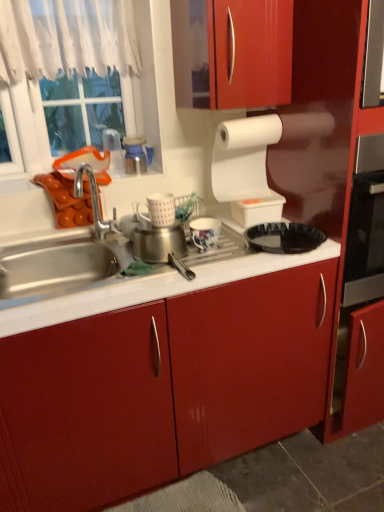
Question: In which direction should I rotate to look at porcelain floral mug at center, the 2th appliance when ordered from right to left?

Choices:
 (A) right
 (B) left

Answer: (A)

Question: Is white sheer curtain at upper left to the right of white matte paper towel at upper right from the viewer's perspective?

Choices:
 (A) yes
 (B) no

Answer: (B)

Question: Is white sheer curtain at upper left to the left of white matte paper towel at upper right from the viewer's perspective?

Choices:
 (A) yes
 (B) no

Answer: (A)

Question: Could you tell me if white sheer curtain at upper left is turned towards white matte paper towel at upper right?

Choices:
 (A) yes
 (B) no

Answer: (B)

Question: Is white sheer curtain at upper left positioned far away from white matte paper towel at upper right?

Choices:
 (A) no
 (B) yes

Answer: (A)

Question: Can you confirm if white sheer curtain at upper left is taller than white matte paper towel at upper right?

Choices:
 (A) yes
 (B) no

Answer: (B)

Question: Does white sheer curtain at upper left have a lesser height compared to white matte paper towel at upper right?

Choices:
 (A) no
 (B) yes

Answer: (B)

Question: Is white sheer curtain at upper left not close to white glossy mug at center, arranged as the second appliance when viewed from the left?

Choices:
 (A) yes
 (B) no

Answer: (B)

Question: Considering the relative positions of white sheer curtain at upper left and white glossy mug at center, arranged as the 3th appliance when viewed from the right, in the image provided, is white sheer curtain at upper left to the right of white glossy mug at center, arranged as the 3th appliance when viewed from the right, from the viewer's perspective?

Choices:
 (A) yes
 (B) no

Answer: (B)

Question: Is white sheer curtain at upper left facing towards white glossy mug at center, arranged as the second appliance when viewed from the left?

Choices:
 (A) no
 (B) yes

Answer: (A)

Question: From a real-world perspective, is white sheer curtain at upper left under white glossy mug at center, arranged as the 3th appliance when viewed from the right?

Choices:
 (A) no
 (B) yes

Answer: (A)

Question: Does white sheer curtain at upper left have a smaller size compared to white glossy mug at center, arranged as the second appliance when viewed from the left?

Choices:
 (A) yes
 (B) no

Answer: (B)

Question: Does white sheer curtain at upper left have a lesser height compared to white glossy mug at center, arranged as the second appliance when viewed from the left?

Choices:
 (A) no
 (B) yes

Answer: (A)

Question: From a real-world perspective, is black plastic tray at center located higher than white plastic container at upper center, positioned as the 4th appliance in left-to-right order?

Choices:
 (A) yes
 (B) no

Answer: (B)